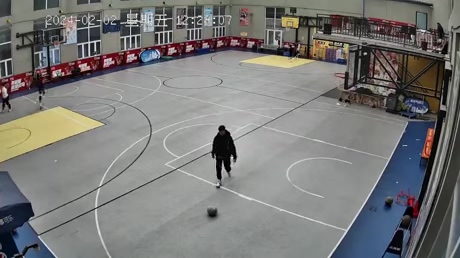
Where is `poster`? This screenshot has height=258, width=460. poster is located at coordinates (119, 65), (101, 67).